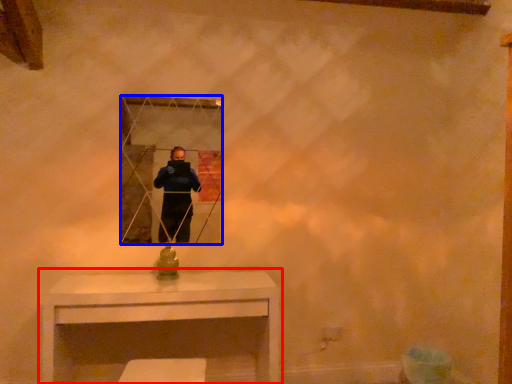
Question: Which of the following is the farthest to the observer, table (highlighted by a red box) or mirror (highlighted by a blue box)?

Choices:
 (A) table
 (B) mirror

Answer: (B)